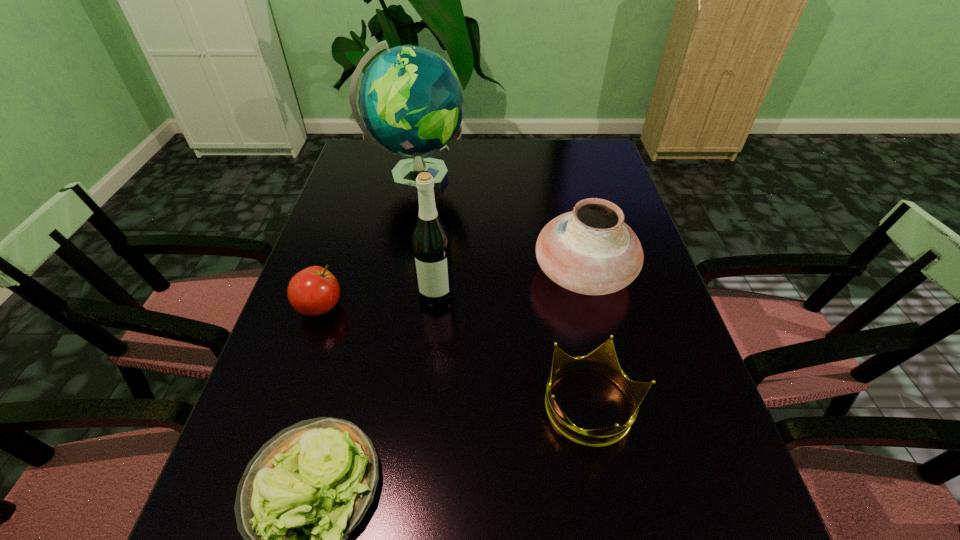
Locate an element on the screen. The width and height of the screenshot is (960, 540). free space located 0.150m on the left of the crown is located at coordinates (465, 407).

The image size is (960, 540). In order to click on object located in the far edge section of the desktop in this screenshot , I will do `click(411, 100)`.

Find the location of `globe present at the left edge`. globe present at the left edge is located at coordinates (411, 100).

Where is `apple positioned at the left edge`? The image size is (960, 540). apple positioned at the left edge is located at coordinates (313, 291).

Identify the location of pottery positioned at the right edge. This screenshot has height=540, width=960. (590, 250).

You are a GUI agent. You are given a task and a screenshot of the screen. Output one action in this format:
    pyautogui.click(x=<x>, y=<y>)
    Task: Click on the crown positioned at the right edge
    
    Given the screenshot: What is the action you would take?
    pyautogui.click(x=603, y=360)

What are the coordinates of `object that is at the far left corner` in the screenshot? It's located at (411, 100).

Where is `vacant position at the left edge of the desktop`? vacant position at the left edge of the desktop is located at coordinates click(x=268, y=408).

At what (x,y) coordinates should I click in order to perform the action: click on free location at the right edge of the desktop. Please return your answer as a coordinate pair (x, y). This screenshot has width=960, height=540. Looking at the image, I should click on (573, 200).

Find the location of a particular element. vacant area at the far left corner is located at coordinates (370, 163).